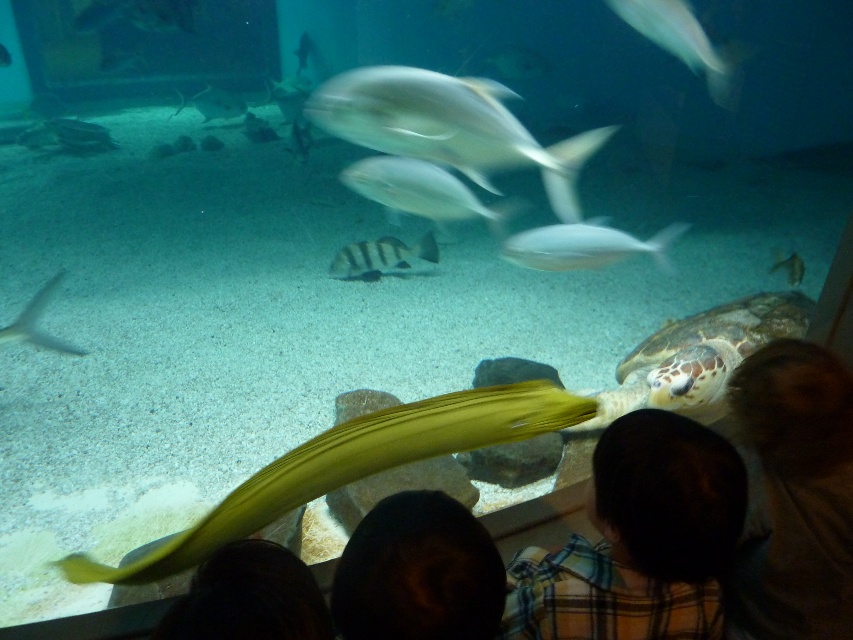
Is plaid fabric shirt at lower right bigger than smooth silver fish at center?

Yes, plaid fabric shirt at lower right is bigger than smooth silver fish at center.

How distant is plaid fabric shirt at lower right from smooth silver fish at center?

A distance of 9.17 feet exists between plaid fabric shirt at lower right and smooth silver fish at center.

Where is `plaid fabric shirt at lower right`? This screenshot has width=853, height=640. plaid fabric shirt at lower right is located at coordinates (639, 540).

Does plaid fabric shirt at lower right appear on the left side of silvery metallic fish at center?

No, plaid fabric shirt at lower right is not to the left of silvery metallic fish at center.

In the scene shown: Can you confirm if plaid fabric shirt at lower right is shorter than silvery metallic fish at center?

No, plaid fabric shirt at lower right is not shorter than silvery metallic fish at center.

Is point (602, 528) more distant than point (479, 80)?

No, (602, 528) is closer to viewer.

Locate an element on the screen. plaid fabric shirt at lower right is located at coordinates (639, 540).

Does striped matte fish at center appear on the right side of smooth silver fish at center?

Incorrect, striped matte fish at center is not on the right side of smooth silver fish at center.

How far apart are striped matte fish at center and smooth silver fish at center?

The distance of striped matte fish at center from smooth silver fish at center is 1.91 meters.

Describe the element at coordinates (379, 257) in the screenshot. This screenshot has width=853, height=640. I see `striped matte fish at center` at that location.

Find the location of a particular element. striped matte fish at center is located at coordinates (379, 257).